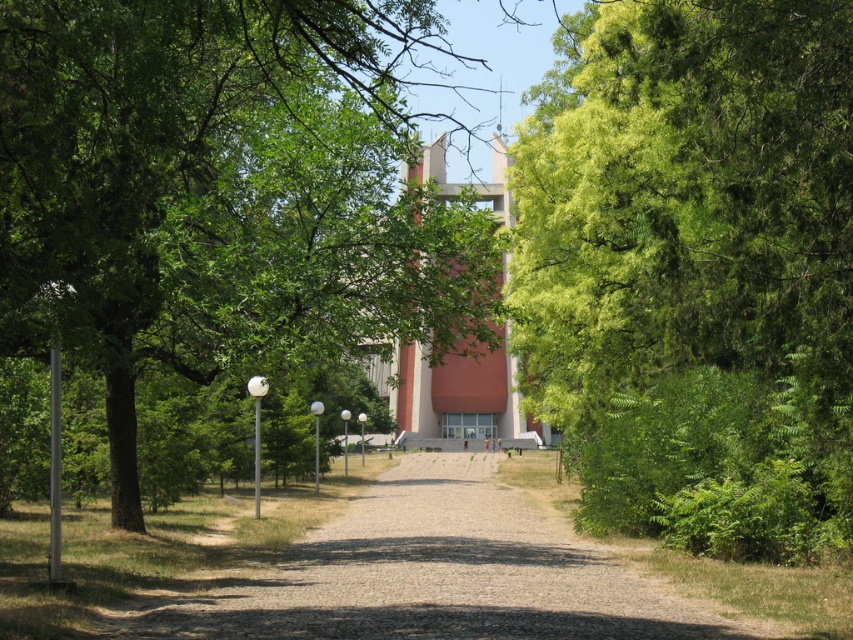
What do you see at coordinates (695, 272) in the screenshot? I see `green leafy tree at right` at bounding box center [695, 272].

Can you confirm if green leafy tree at right is taller than gravel driveway at center?

Indeed, green leafy tree at right has a greater height compared to gravel driveway at center.

Where is `green leafy tree at right`? The height and width of the screenshot is (640, 853). green leafy tree at right is located at coordinates (695, 272).

Does green leafy tree at right have a lesser width compared to green leafy tree at center?

Yes.

The width and height of the screenshot is (853, 640). What do you see at coordinates (695, 272) in the screenshot?
I see `green leafy tree at right` at bounding box center [695, 272].

Is point (728, 257) closer to camera compared to point (59, 200)?

No, (728, 257) is behind (59, 200).

Where is `green leafy tree at right`? This screenshot has height=640, width=853. green leafy tree at right is located at coordinates (695, 272).

Is green leafy tree at center to the left of gravel driveway at center from the viewer's perspective?

Indeed, green leafy tree at center is positioned on the left side of gravel driveway at center.

Between green leafy tree at center and gravel driveway at center, which one appears on the right side from the viewer's perspective?

gravel driveway at center

Identify the location of green leafy tree at center. Image resolution: width=853 pixels, height=640 pixels. (219, 193).